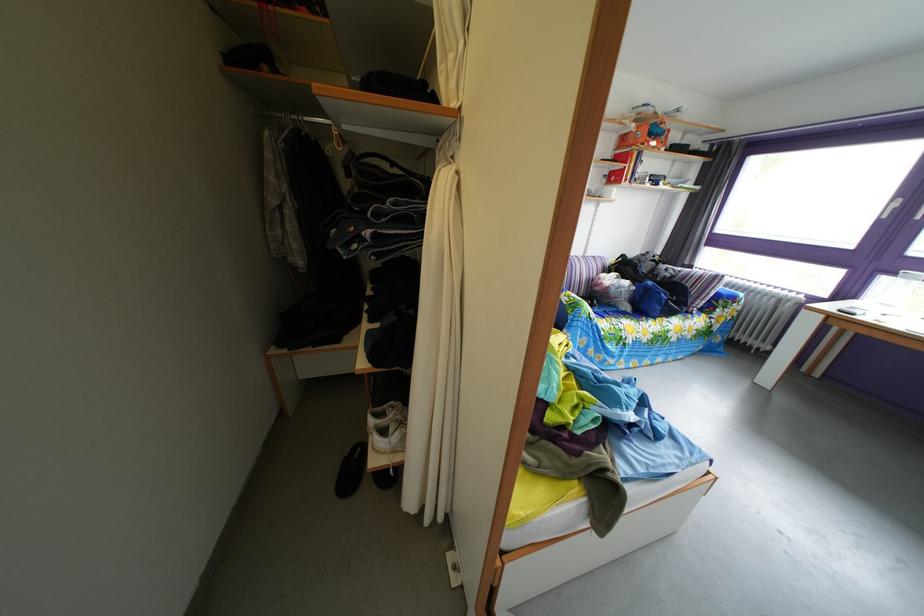
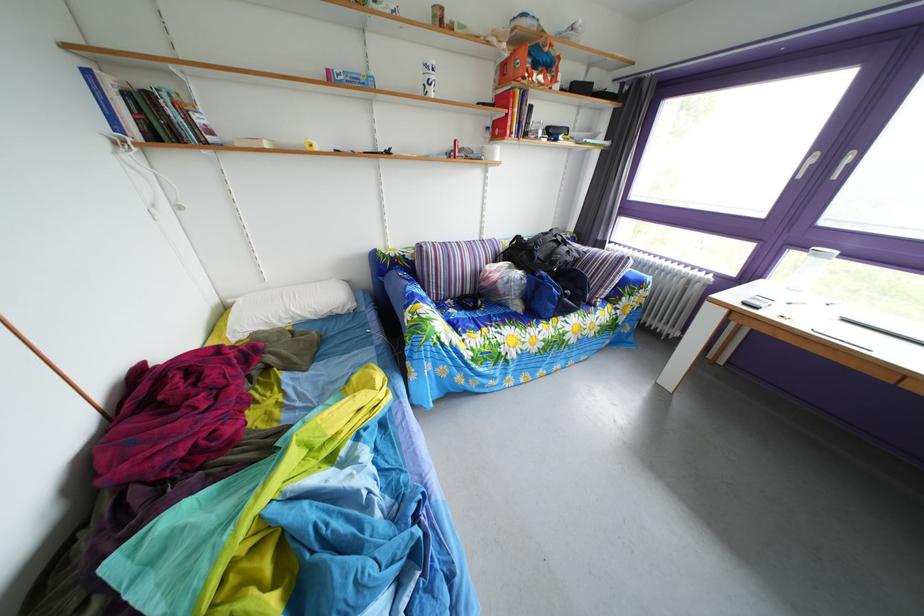
What movement of the cameraman would produce the second image?

The movement direction of the cameraman is right, forward.